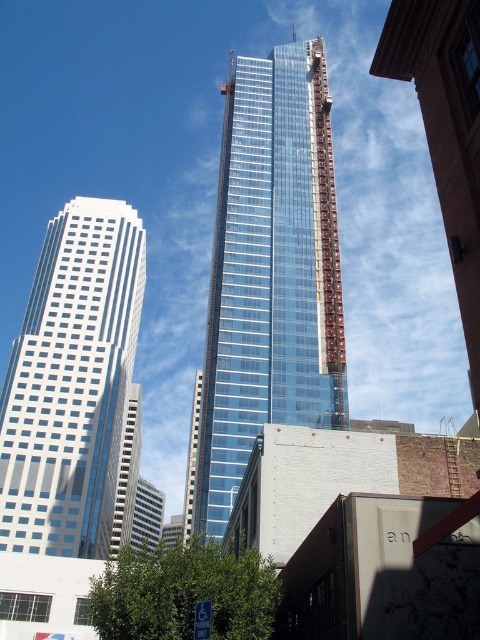
Can you confirm if transparent glass tower at center is wider than white glass building at left?

Yes, transparent glass tower at center is wider than white glass building at left.

Identify the location of transparent glass tower at center. This screenshot has height=640, width=480. (269, 273).